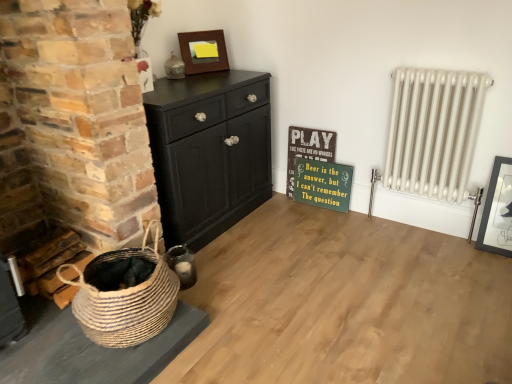
Question: Relative to matte black picture frame at right, arranged as the 2th picture frame when viewed from the back, is white metal radiator at right in front or behind?

Choices:
 (A) front
 (B) behind

Answer: (A)

Question: From the image's perspective, is white metal radiator at right located above or below matte black picture frame at right, acting as the 1th picture frame starting from the right?

Choices:
 (A) above
 (B) below

Answer: (A)

Question: Estimate the real-world distances between objects in this image. Which object is farther from the matte black picture frame at right, acting as the first picture frame starting from the bottom?

Choices:
 (A) green painted wood signboard at center-right
 (B) wooden picture frame at upper center, arranged as the first picture frame when viewed from the left
 (C) natural woven basket at lower left
 (D) black painted wood chest of drawers at left
 (E) wooden signboard at center

Answer: (C)

Question: Estimate the real-world distances between objects in this image. Which object is farther from the wooden signboard at center?

Choices:
 (A) white metal radiator at right
 (B) matte black picture frame at right, the 1th picture frame when ordered from front to back
 (C) wooden picture frame at upper center, the second picture frame from the bottom
 (D) green painted wood signboard at center-right
 (E) black painted wood chest of drawers at left

Answer: (B)